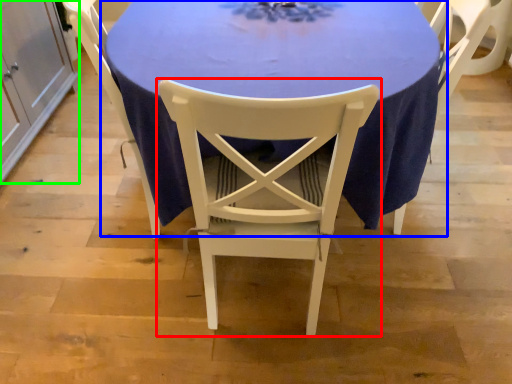
Question: Considering the real-world distances, which object is farthest from chair (highlighted by a red box)? table (highlighted by a blue box) or cabinetry (highlighted by a green box)?

Choices:
 (A) table
 (B) cabinetry

Answer: (B)